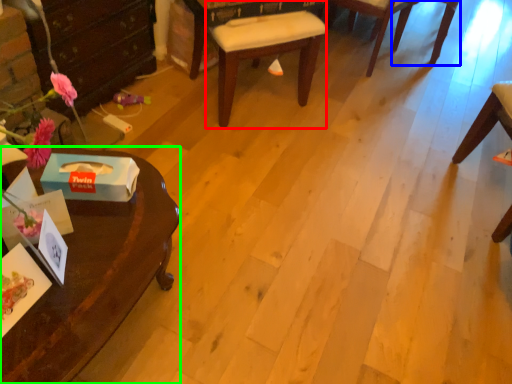
Question: Which is nearer to the chair (highlighted by a red box)? chair (highlighted by a blue box) or desk (highlighted by a green box).

Choices:
 (A) chair
 (B) desk

Answer: (B)